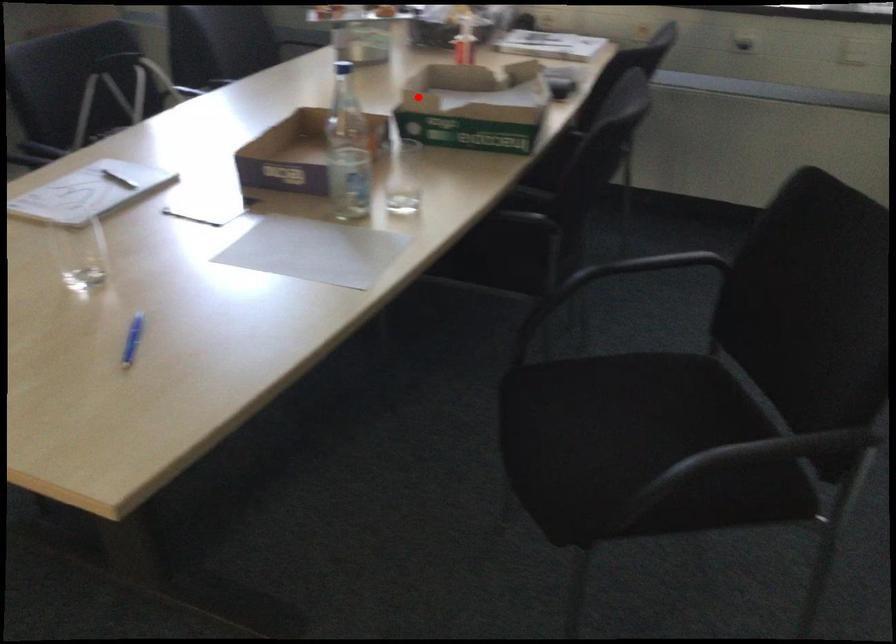
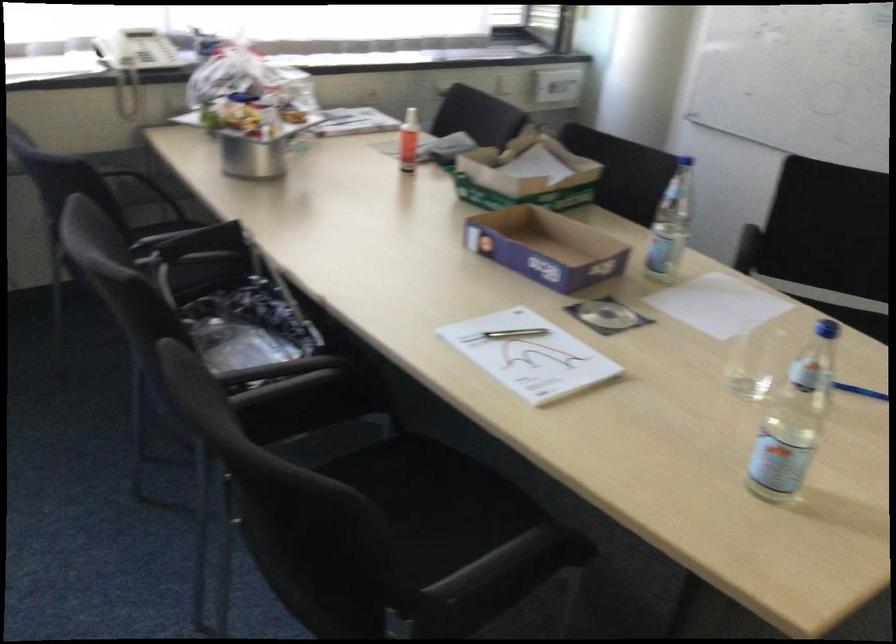
Question: I am providing you with two images of the same scene from different viewpoints. In image1, a red point is highlighted. Considering the same 3D point in image2, which of the following is correct?

Choices:
 (A) It is closer
 (B) It is farther

Answer: (B)